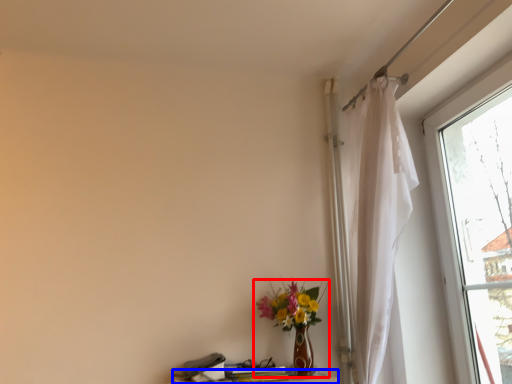
Question: Among these objects, which one is nearest to the camera, houseplant (highlighted by a red box) or table (highlighted by a blue box)?

Choices:
 (A) houseplant
 (B) table

Answer: (B)